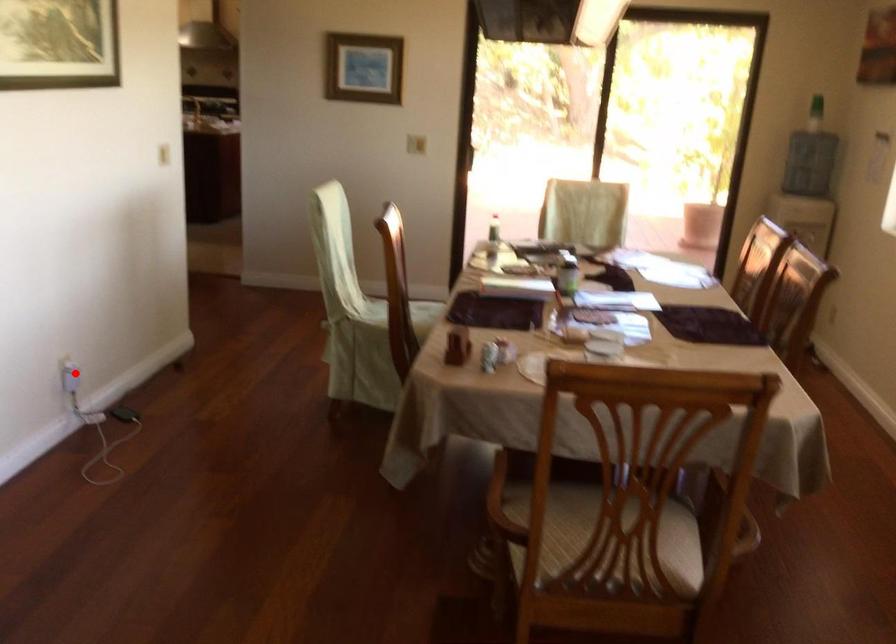
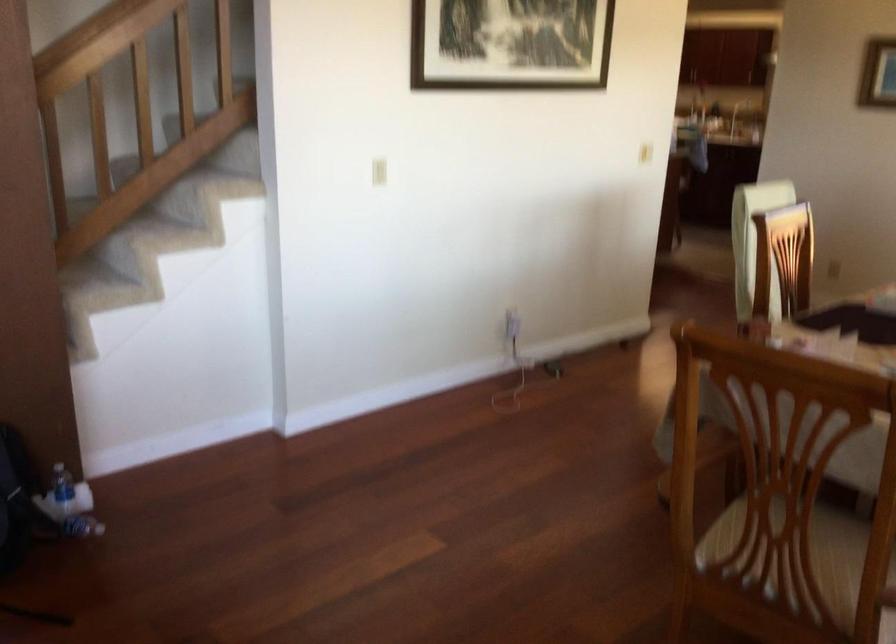
Question: A red point is marked in image1. In image2, is the corresponding 3D point closer to the camera or farther? Reply with the corresponding letter.

Choices:
 (A) The corresponding 3D point is closer.
 (B) The corresponding 3D point is farther.

Answer: (B)